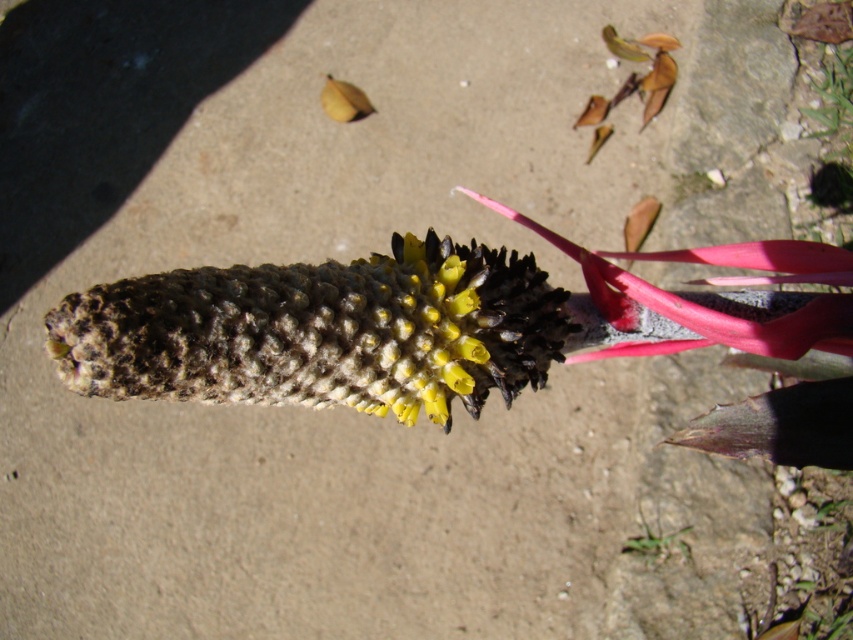
Does point (161, 384) come in front of point (654, 554)?

Yes, point (161, 384) is in front of point (654, 554).

Between point (225, 355) and point (664, 538), which one is positioned in front?

Point (225, 355)

This screenshot has width=853, height=640. What are the coordinates of `leathery brown flower at center` in the screenshot? It's located at (320, 332).